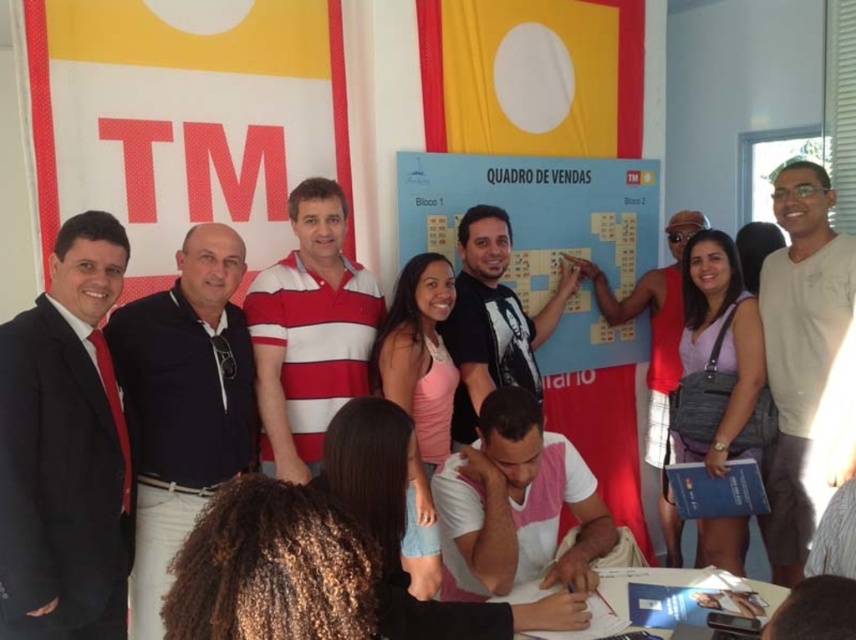
Is matte black suit at left bigger than black t-shirt at center?

Incorrect, matte black suit at left is not larger than black t-shirt at center.

From the picture: Between matte black suit at left and black t-shirt at center, which one appears on the right side from the viewer's perspective?

black t-shirt at center is more to the right.

Locate an element on the screen. matte black suit at left is located at coordinates (64, 449).

Is blue matte board at center thinner than white striped polo shirt at center?

No, blue matte board at center is not thinner than white striped polo shirt at center.

Is point (604, 259) positioned before point (247, 314)?

No.

Which is behind, point (623, 164) or point (337, 364)?

The point (623, 164) is more distant.

Find the location of a particular element. This screenshot has height=640, width=856. blue matte board at center is located at coordinates (535, 212).

Who is higher up, matte black suit at left or light beige t-shirt at right?

Positioned higher is light beige t-shirt at right.

Which is more to the left, matte black suit at left or light beige t-shirt at right?

matte black suit at left is more to the left.

Is point (39, 618) positioned behind point (794, 499)?

No.

Identify the location of matte black suit at left. (64, 449).